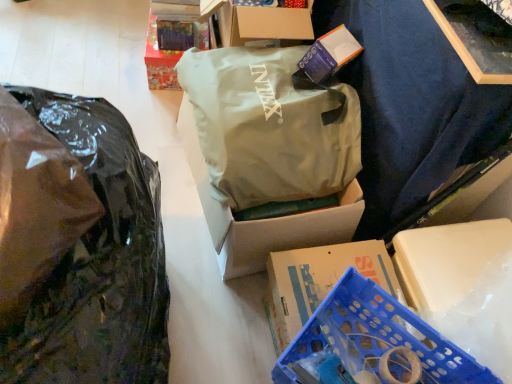
Question: Is blue plastic crate at lower right smaller than transparent plastic bag at left, which ranks as the 2th plastic bag in right-to-left order?

Choices:
 (A) yes
 (B) no

Answer: (A)

Question: Does blue plastic crate at lower right turn towards transparent plastic bag at left, which ranks as the 2th plastic bag in right-to-left order?

Choices:
 (A) yes
 (B) no

Answer: (B)

Question: Is transparent plastic bag at left, which ranks as the 2th plastic bag in right-to-left order, surrounded by blue plastic crate at lower right?

Choices:
 (A) yes
 (B) no

Answer: (B)

Question: Is blue plastic crate at lower right at the left side of transparent plastic bag at left, which ranks as the 2th plastic bag in right-to-left order?

Choices:
 (A) yes
 (B) no

Answer: (B)

Question: From a real-world perspective, is blue plastic crate at lower right on top of transparent plastic bag at left, which is counted as the first plastic bag, starting from the left?

Choices:
 (A) yes
 (B) no

Answer: (A)

Question: From the image's perspective, is blue plastic crate at lower right under transparent plastic bag at left, which is counted as the first plastic bag, starting from the left?

Choices:
 (A) no
 (B) yes

Answer: (B)

Question: Is blue plastic crate at lower right directly adjacent to transparent plastic bag at left, which is counted as the first plastic bag, starting from the left?

Choices:
 (A) yes
 (B) no

Answer: (B)

Question: Would you say blue plastic crate at lower right is outside transparent plastic bag at left, which ranks as the 2th plastic bag in right-to-left order?

Choices:
 (A) no
 (B) yes

Answer: (B)

Question: Does blue plastic crate at lower right have a lesser width compared to transparent plastic bag at left, which ranks as the 2th plastic bag in right-to-left order?

Choices:
 (A) no
 (B) yes

Answer: (B)

Question: Is blue plastic crate at lower right smaller than transparent plastic bag at left, which ranks as the 2th plastic bag in right-to-left order?

Choices:
 (A) yes
 (B) no

Answer: (A)

Question: Considering the relative positions of blue plastic crate at lower right and transparent plastic bag at left, which ranks as the 2th plastic bag in right-to-left order, in the image provided, is blue plastic crate at lower right to the right of transparent plastic bag at left, which ranks as the 2th plastic bag in right-to-left order, from the viewer's perspective?

Choices:
 (A) yes
 (B) no

Answer: (A)

Question: Can you confirm if blue plastic crate at lower right is taller than transparent plastic bag at left, which ranks as the 2th plastic bag in right-to-left order?

Choices:
 (A) no
 (B) yes

Answer: (A)

Question: Does shiny paper box at upper left have a lesser height compared to transparent plastic bag at left, which is counted as the first plastic bag, starting from the left?

Choices:
 (A) no
 (B) yes

Answer: (B)